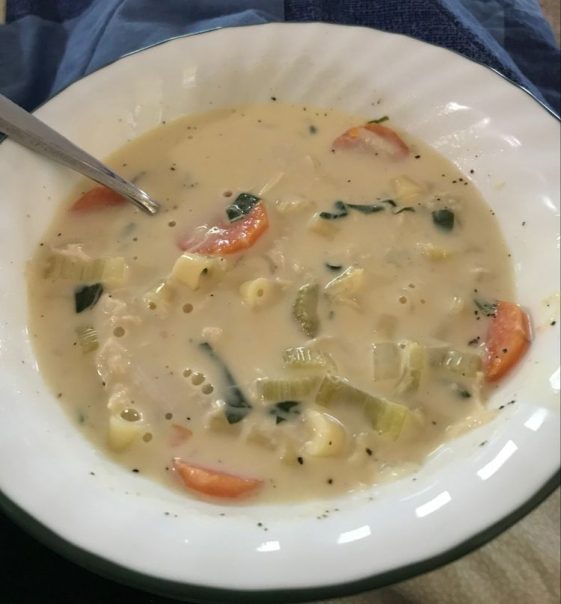
The image size is (561, 604). Find the location of `white bowl`. white bowl is located at coordinates (394, 72).